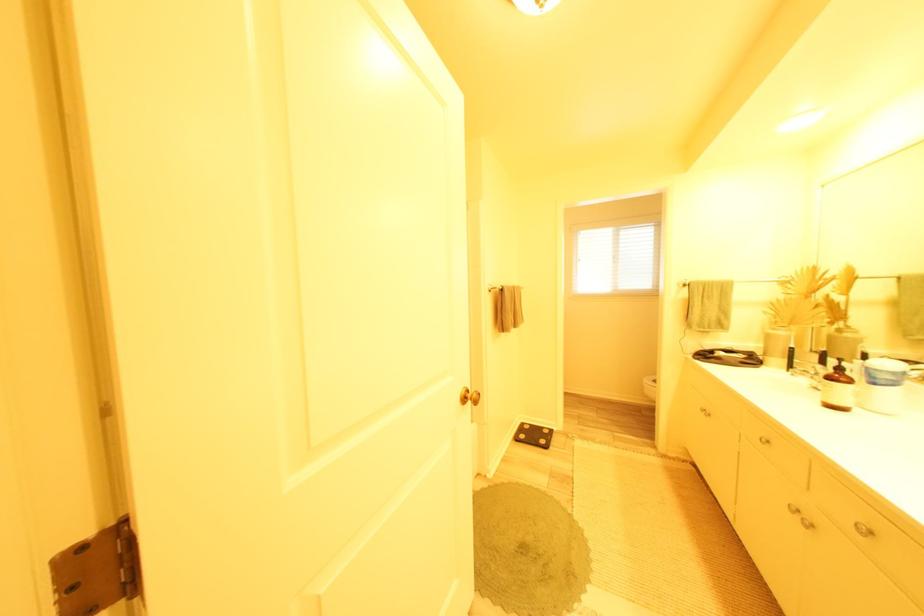
Describe the element at coordinates (837, 389) in the screenshot. I see `a brown bottle pump` at that location.